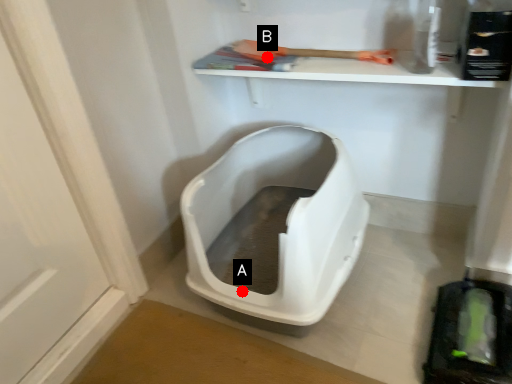
Question: Two points are circled on the image, labeled by A and B beside each circle. Which point is closer to the camera taking this photo?

Choices:
 (A) A is closer
 (B) B is closer

Answer: (A)